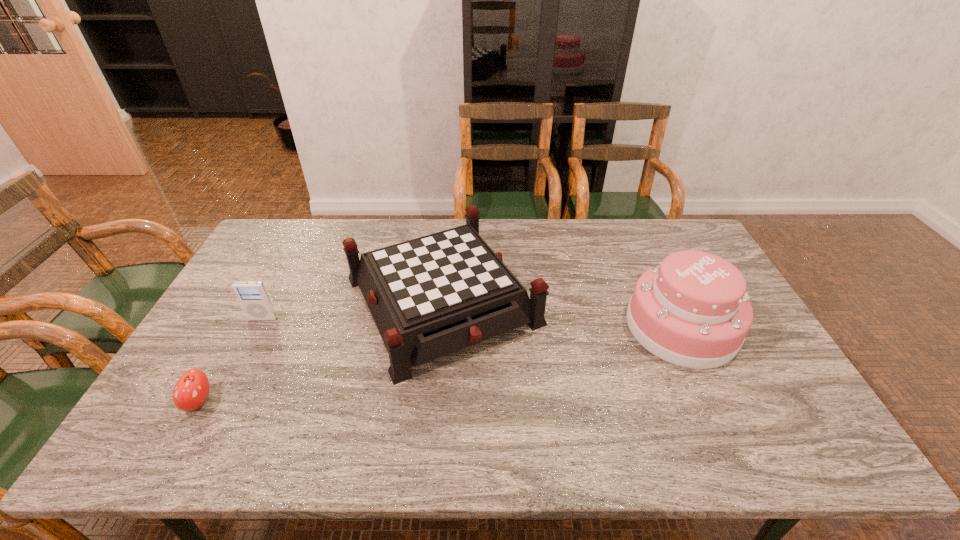
Find the location of a particular element. cake is located at coordinates (692, 310).

Where is `the tallest object`? the tallest object is located at coordinates (692, 310).

Image resolution: width=960 pixels, height=540 pixels. Find the location of `checkerboard`. checkerboard is located at coordinates (431, 296).

Where is `the third tallest object`? the third tallest object is located at coordinates [252, 295].

You are a GUI agent. You are given a task and a screenshot of the screen. Output one action in this format:
    pyautogui.click(x=<x>, y=<y>)
    Task: Click on the apple
    The height and width of the screenshot is (540, 960).
    Given the screenshot: What is the action you would take?
    pyautogui.click(x=191, y=390)

Locate an element on the screen. This screenshot has height=540, width=960. free space located on the back of the rightmost object is located at coordinates (646, 251).

At what (x,y) coordinates should I click in order to perform the action: click on free space located on the left of the third object from left to right. Please return your answer as a coordinate pair (x, y). The image size is (960, 540). Looking at the image, I should click on (227, 300).

Locate an element on the screen. blank area located 0.250m on the front-facing side of the second shortest object is located at coordinates click(x=225, y=394).

At what (x,y) coordinates should I click in order to perform the action: click on vacant area located on the back of the apple. Please return your answer as a coordinate pair (x, y). The width and height of the screenshot is (960, 540). Looking at the image, I should click on (217, 368).

The height and width of the screenshot is (540, 960). In order to click on object situated at the far edge in this screenshot , I will do `click(431, 296)`.